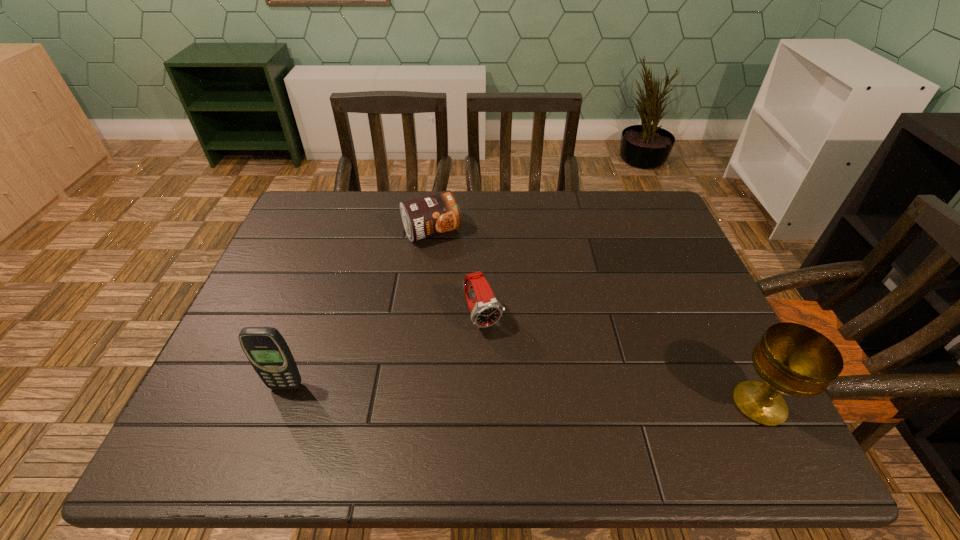
This screenshot has width=960, height=540. I want to click on free spot on the desktop that is between the cellular telephone and the chalice and is positioned on the front label of the can, so click(535, 395).

You are a GUI agent. You are given a task and a screenshot of the screen. Output one action in this format:
    pyautogui.click(x=<x>, y=<y>)
    Task: Click on the vacant space on the desktop that is between the cellular telephone and the rightmost object and is positioned on the face of the second object from right to left
    
    Given the screenshot: What is the action you would take?
    pyautogui.click(x=523, y=395)